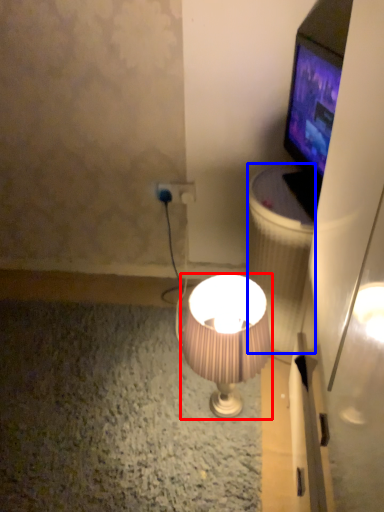
Question: Which object appears farthest to the camera in this image, lamp (highlighted by a red box) or trash bin/can (highlighted by a blue box)?

Choices:
 (A) lamp
 (B) trash bin/can

Answer: (B)